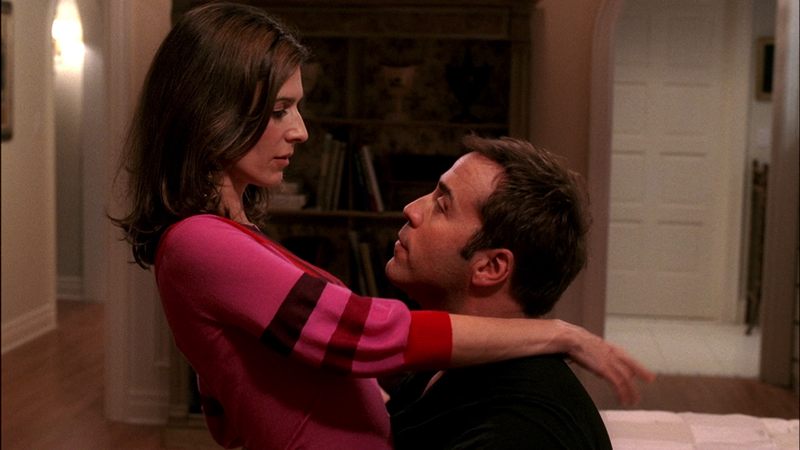
Find the location of `wood floor`. wood floor is located at coordinates (730, 394), (72, 391).